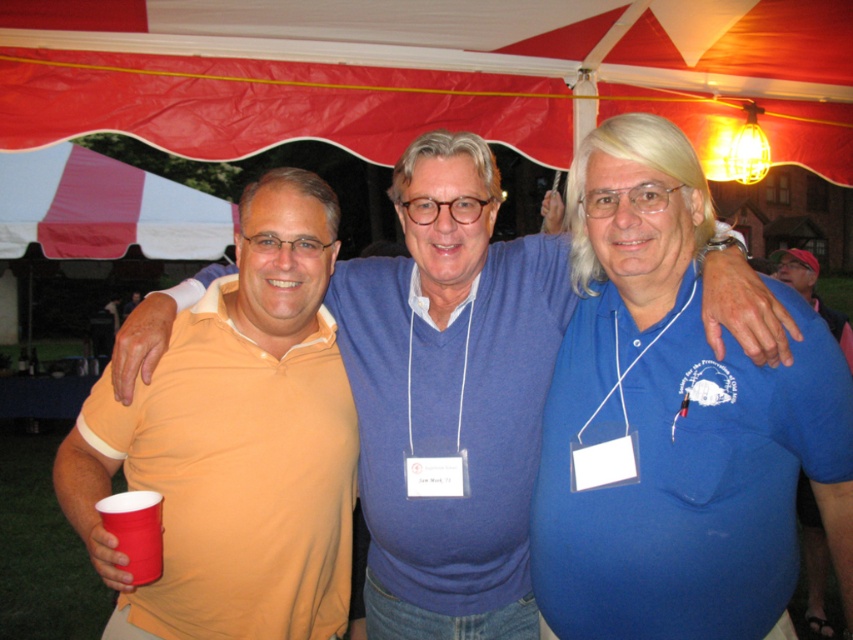
Question: Which point is farther to the camera?

Choices:
 (A) blue cotton shirt at center
 (B) orange matte polo shirt at center
 (C) red plastic cup at lower left
 (D) orange cotton polo shirt at left

Answer: (D)

Question: Which point appears closest to the camera in this image?

Choices:
 (A) (524, 356)
 (B) (163, 481)
 (C) (114, 516)

Answer: (C)

Question: Where is orange cotton polo shirt at left located in relation to red plastic cup at lower left in the image?

Choices:
 (A) below
 (B) above

Answer: (B)

Question: Estimate the real-world distances between objects in this image. Which object is closer to the orange cotton polo shirt at left?

Choices:
 (A) blue cotton shirt at center
 (B) orange matte polo shirt at center
 (C) red plastic cup at lower left

Answer: (B)

Question: Can you confirm if orange matte polo shirt at center is thinner than orange cotton polo shirt at left?

Choices:
 (A) yes
 (B) no

Answer: (B)

Question: Is the position of blue cotton shirt at center more distant than that of orange matte polo shirt at center?

Choices:
 (A) no
 (B) yes

Answer: (B)